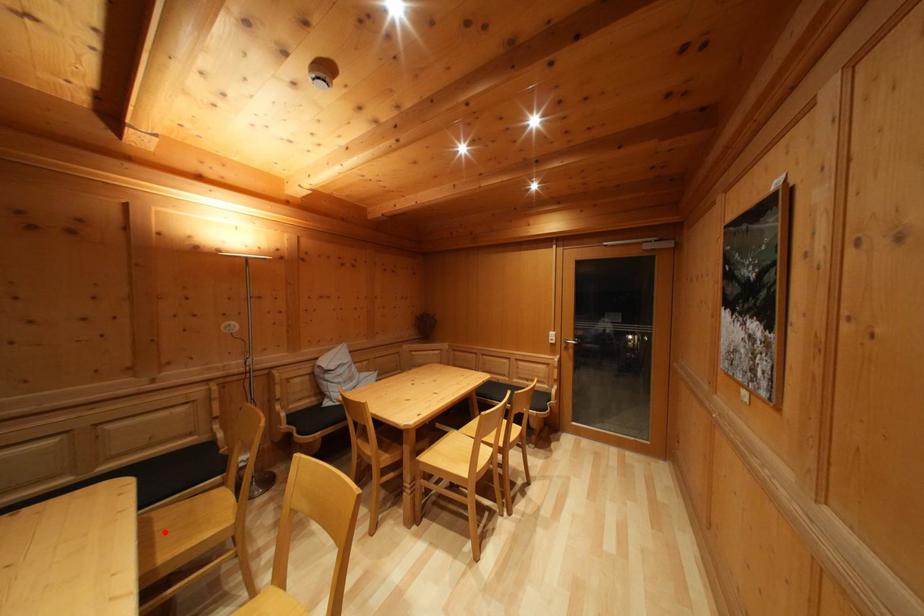
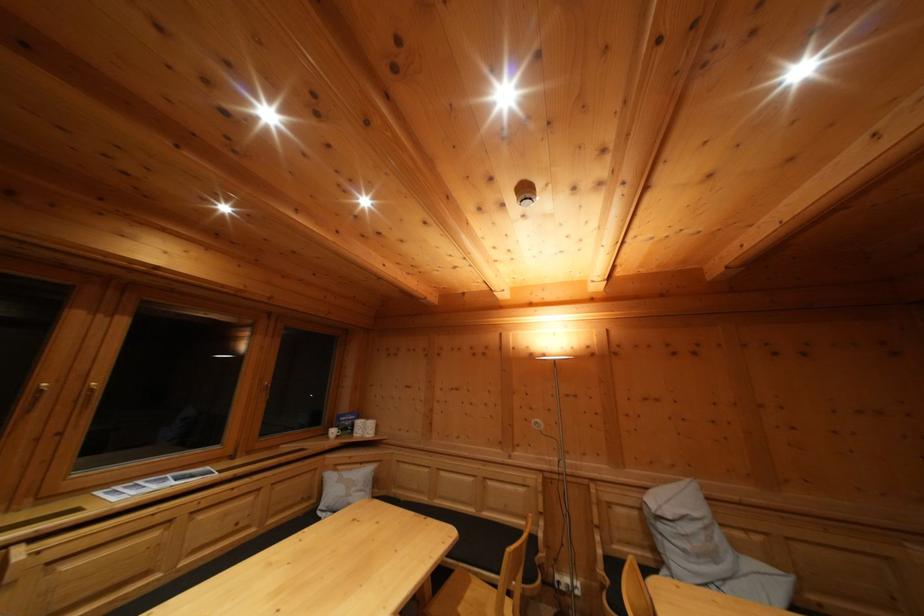
Question: I am providing you with two images of the same scene from different viewpoints. Given a red point in image1, look at the same physical point in image2. Is it:

Choices:
 (A) Closer to the viewpoint
 (B) Farther from the viewpoint

Answer: (A)